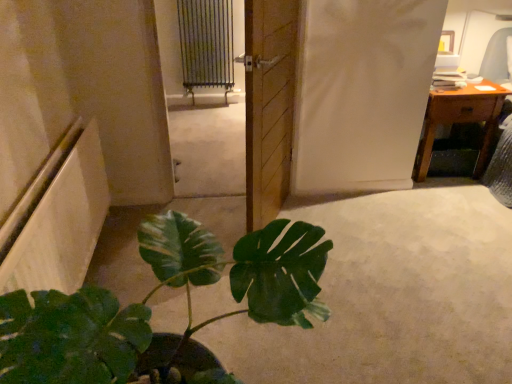
The image size is (512, 384). Identify the location of green matte plant at lower left. (151, 311).

Find the location of a particular element. Image resolution: width=512 pixels, height=384 pixels. wooden desk at upper right is located at coordinates click(x=460, y=119).

You are a GUI agent. You are given a task and a screenshot of the screen. Output one action in this format:
    pyautogui.click(x=<x>, y=<y>)
    Task: Click on the radiator positioned vertically above the green matte plant at lower left (from a real-world perspective)
    Image resolution: width=512 pixels, height=384 pixels.
    Given the screenshot: What is the action you would take?
    click(x=206, y=44)

From the image's perspective, between metallic radiator at upper center and green matte plant at lower left, which one is located above?

metallic radiator at upper center is shown above in the image.

Considering the positions of objects metallic radiator at upper center and green matte plant at lower left in the image provided, who is in front, metallic radiator at upper center or green matte plant at lower left?

Positioned in front is green matte plant at lower left.

Is metallic radiator at upper center positioned with its back to green matte plant at lower left?

No, metallic radiator at upper center is not facing the opposite direction of green matte plant at lower left.

Is wooden desk at upper right facing away from wooden door at center?

No, wooden desk at upper right is not facing away from wooden door at center.

Is wooden desk at upper right to the right of wooden door at center from the viewer's perspective?

Yes, wooden desk at upper right is to the right of wooden door at center.

Choose the correct answer: Is wooden desk at upper right inside wooden door at center or outside it?

wooden desk at upper right cannot be found inside wooden door at center.

Is metallic radiator at upper center further to camera compared to wooden door at center?

Yes.

Is metallic radiator at upper center taller than wooden door at center?

In fact, metallic radiator at upper center may be shorter than wooden door at center.

From the image's perspective, which one is positioned lower, metallic radiator at upper center or wooden door at center?

wooden door at center appears lower in the image.

Is metallic radiator at upper center located outside wooden door at center?

metallic radiator at upper center lies outside wooden door at center's area.

From a real-world perspective, is green matte plant at lower left below wooden desk at upper right?

Incorrect, from a real-world perspective, green matte plant at lower left is higher than wooden desk at upper right.

Considering the positions of objects green matte plant at lower left and wooden desk at upper right in the image provided, who is more to the right, green matte plant at lower left or wooden desk at upper right?

Positioned to the right is wooden desk at upper right.

Could you tell me if green matte plant at lower left is facing wooden desk at upper right?

No, green matte plant at lower left is not oriented towards wooden desk at upper right.

Is green matte plant at lower left next to wooden desk at upper right?

green matte plant at lower left is not next to wooden desk at upper right, and they're not touching.

Can you confirm if green matte plant at lower left is positioned to the right of metallic radiator at upper center?

Yes.

Which object is thinner, green matte plant at lower left or metallic radiator at upper center?

Thinner between the two is metallic radiator at upper center.

Where is `houseplant lying in front of the metallic radiator at upper center`? The width and height of the screenshot is (512, 384). houseplant lying in front of the metallic radiator at upper center is located at coordinates (151, 311).

Can you confirm if green matte plant at lower left is bigger than metallic radiator at upper center?

Yes, green matte plant at lower left is bigger than metallic radiator at upper center.

Does wooden door at center have a lesser width compared to green matte plant at lower left?

Yes.

Are wooden door at center and green matte plant at lower left beside each other?

No, wooden door at center is not touching green matte plant at lower left.

How different are the orientations of wooden door at center and green matte plant at lower left in degrees?

23.4 degrees separate the facing orientations of wooden door at center and green matte plant at lower left.

Considering the relative sizes of wooden door at center and wooden desk at upper right in the image provided, is wooden door at center smaller than wooden desk at upper right?

Correct, wooden door at center occupies less space than wooden desk at upper right.

Between wooden door at center and wooden desk at upper right, which one has more height?

Standing taller between the two is wooden door at center.

Considering the positions of objects wooden door at center and wooden desk at upper right in the image provided, who is more to the right, wooden door at center or wooden desk at upper right?

From the viewer's perspective, wooden desk at upper right appears more on the right side.

Is wooden door at center in front of or behind wooden desk at upper right in the image?

wooden door at center is positioned closer to the viewer than wooden desk at upper right.

Where is `houseplant in front of the metallic radiator at upper center`? Image resolution: width=512 pixels, height=384 pixels. houseplant in front of the metallic radiator at upper center is located at coordinates (151, 311).

The height and width of the screenshot is (384, 512). What are the coordinates of `table on the right of the wooden door at center` in the screenshot? It's located at (460, 119).

Considering their positions, is wooden desk at upper right positioned closer to wooden door at center than green matte plant at lower left?

green matte plant at lower left.

Looking at the image, which one is located further to wooden desk at upper right, green matte plant at lower left or wooden door at center?

Among the two, green matte plant at lower left is located further to wooden desk at upper right.

Considering their positions, is green matte plant at lower left positioned further to wooden door at center than metallic radiator at upper center?

Among the two, metallic radiator at upper center is located further to wooden door at center.

Based on their spatial positions, is wooden door at center or metallic radiator at upper center further from green matte plant at lower left?

The object further to green matte plant at lower left is metallic radiator at upper center.

Looking at this image, from the image, which object appears to be nearer to green matte plant at lower left, metallic radiator at upper center or wooden desk at upper right?

wooden desk at upper right is closer to green matte plant at lower left.

Which object lies further to the anchor point green matte plant at lower left, wooden desk at upper right or wooden door at center?

The object further to green matte plant at lower left is wooden desk at upper right.

From the image, which object appears to be nearer to wooden door at center, wooden desk at upper right or metallic radiator at upper center?

The object closer to wooden door at center is wooden desk at upper right.

Looking at the image, which one is located further to wooden desk at upper right, metallic radiator at upper center or green matte plant at lower left?

Based on the image, metallic radiator at upper center appears to be further to wooden desk at upper right.

The height and width of the screenshot is (384, 512). What are the coordinates of `table between wooden door at center and metallic radiator at upper center in the front-back direction` in the screenshot? It's located at (460, 119).

I want to click on door between green matte plant at lower left and wooden desk at upper right from front to back, so click(269, 105).

You are a GUI agent. You are given a task and a screenshot of the screen. Output one action in this format:
    pyautogui.click(x=<x>, y=<y>)
    Task: Click on the table between green matte plant at lower left and metallic radiator at upper center in the front-back direction
    The height and width of the screenshot is (384, 512).
    Given the screenshot: What is the action you would take?
    pyautogui.click(x=460, y=119)

You are a GUI agent. You are given a task and a screenshot of the screen. Output one action in this format:
    pyautogui.click(x=<x>, y=<y>)
    Task: Click on the door positioned between green matte plant at lower left and metallic radiator at upper center from near to far
    The width and height of the screenshot is (512, 384).
    Given the screenshot: What is the action you would take?
    pyautogui.click(x=269, y=105)